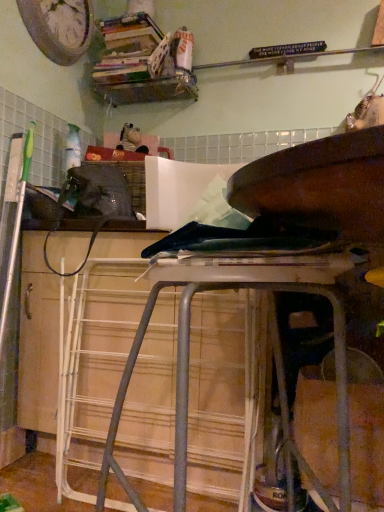
Question: From a real-world perspective, is wooden clock at upper left above or below wooden bookshelf at upper center?

Choices:
 (A) below
 (B) above

Answer: (B)

Question: Is point (36, 33) positioned closer to the camera than point (190, 88)?

Choices:
 (A) closer
 (B) farther

Answer: (A)

Question: Considering the real-world distances, which object is closest to the wooden clock at upper left?

Choices:
 (A) metallic silver stool at center
 (B) wooden bookshelf at upper center

Answer: (B)

Question: Estimate the real-world distances between objects in this image. Which object is closer to the wooden bookshelf at upper center?

Choices:
 (A) wooden clock at upper left
 (B) metallic silver stool at center

Answer: (A)